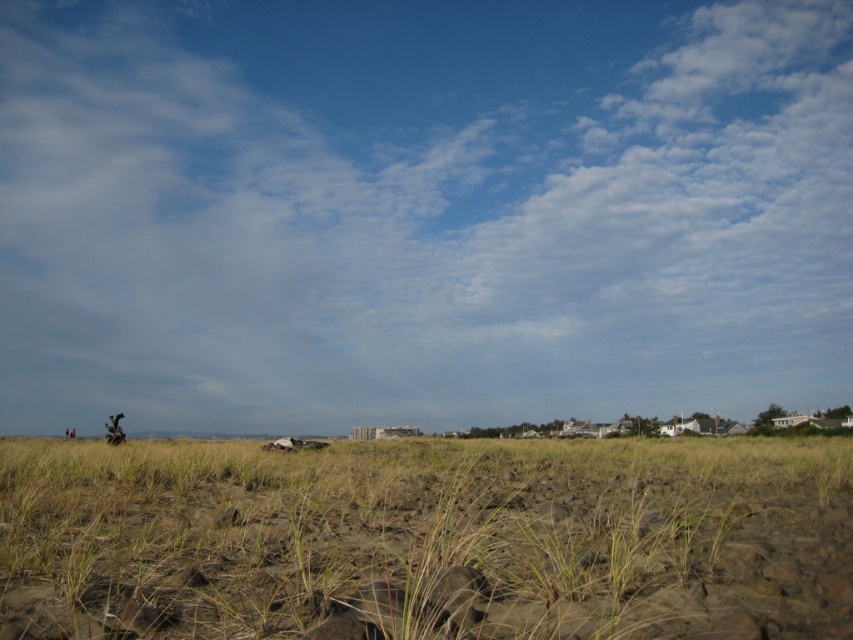
Question: Is white fluffy cloud at upper center to the left of brown sandy dirt field at center from the viewer's perspective?

Choices:
 (A) no
 (B) yes

Answer: (B)

Question: Can you confirm if white fluffy cloud at upper center is positioned above brown sandy dirt field at center?

Choices:
 (A) no
 (B) yes

Answer: (B)

Question: Is white fluffy cloud at upper center below brown sandy dirt field at center?

Choices:
 (A) yes
 (B) no

Answer: (B)

Question: Which point is closer to the camera?

Choices:
 (A) (779, 609)
 (B) (659, 81)

Answer: (A)

Question: Among these objects, which one is nearest to the camera?

Choices:
 (A) white fluffy cloud at upper center
 (B) brown sandy dirt field at center

Answer: (B)

Question: Which point appears closest to the camera in this image?

Choices:
 (A) (569, 157)
 (B) (497, 634)

Answer: (B)